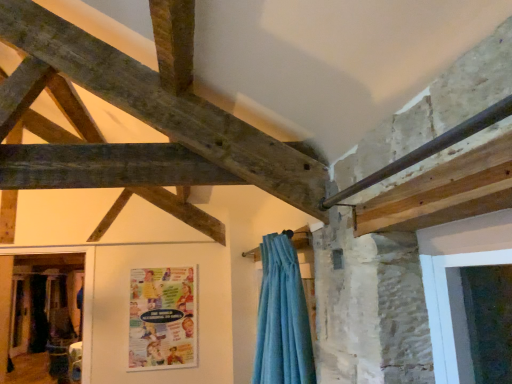
The image size is (512, 384). Describe the element at coordinates (162, 318) in the screenshot. I see `vivid collage poster at lower center` at that location.

What is the approximate width of vivid collage poster at lower center?

vivid collage poster at lower center is 1.55 inches in width.

Image resolution: width=512 pixels, height=384 pixels. In order to click on vivid collage poster at lower center in this screenshot , I will do `click(162, 318)`.

At what (x,y) coordinates should I click in order to perform the action: click on vivid collage poster at lower center. Please return your answer as a coordinate pair (x, y). Looking at the image, I should click on (162, 318).